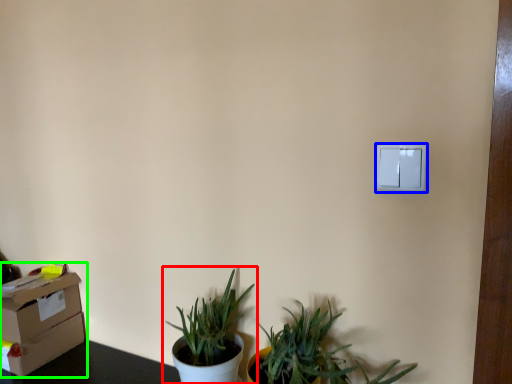
Question: Which object is the closest to the houseplant (highlighted by a red box)? Choose among these: light switch (highlighted by a blue box) or cardboard box (highlighted by a green box).

Choices:
 (A) light switch
 (B) cardboard box

Answer: (B)